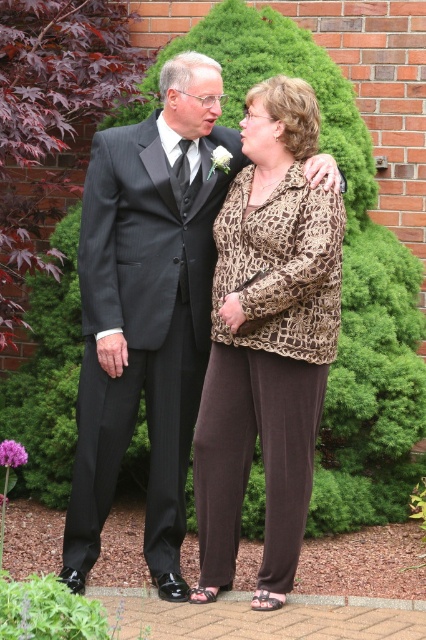
You are a photographer setting up for a photoshoot. You need to ensure that the leopard print blouse at center and the dark gray pinstripe suit at left are visible in the frame. Given that your camera has a minimum focus distance of 40 centimeters, will you be able to capture both items clearly without moving the camera closer?

The leopard print blouse at center is 39.46 centimeters from the dark gray pinstripe suit at left. Since the distance between them is less than the camera minimum focus distance of 40 centimeters, the camera may not be able to focus on both items clearly without moving closer.

You are a photographer trying to capture a detailed shot of the leopard print blouse at center. The camera you are using has a focus point at coordinate point [267,340]. Will this focus point help you capture the leopard print blouse at center?

Yes, the focus point at [267,340] is marked as the location of the leopard print blouse at center, so using this point will help capture it.